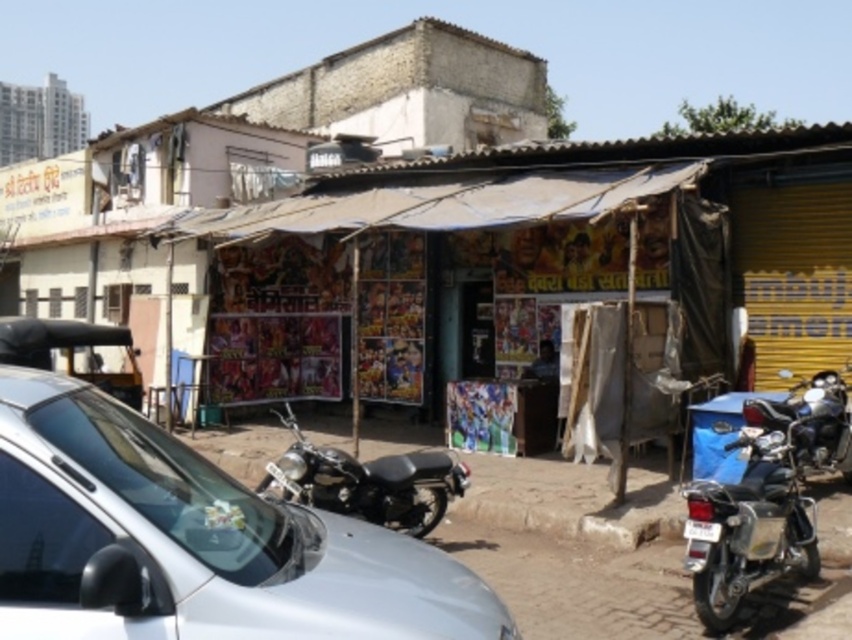
From the picture: You are standing at the point marked by the coordinates point (367, 481). What object are you directly facing in the scene?

The point (367, 481) corresponds to the shiny black motorcycle at center, so you are directly facing the shiny black motorcycle at center.